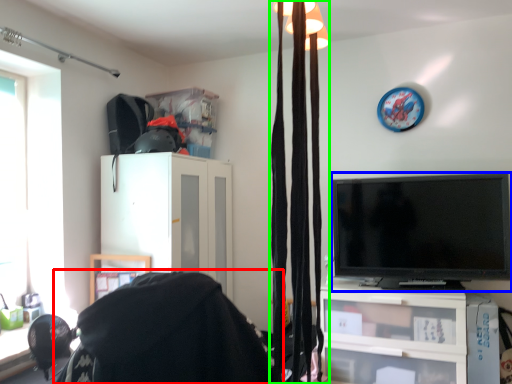
Question: Based on their relative distances, which object is nearer to bean bag chair (highlighted by a red box)? Choose from television (highlighted by a blue box) and curtain (highlighted by a green box).

Choices:
 (A) television
 (B) curtain

Answer: (B)